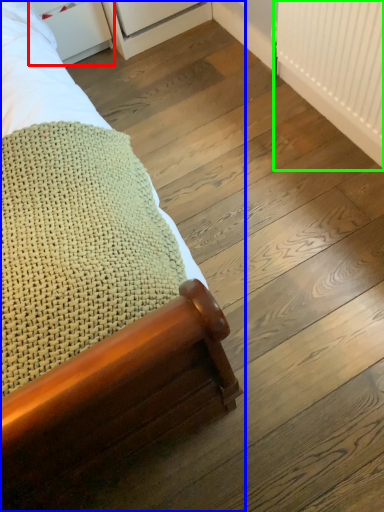
Question: Considering the real-world distances, which object is farthest from drawer (highlighted by a red box)? bed (highlighted by a blue box) or radiator (highlighted by a green box)?

Choices:
 (A) bed
 (B) radiator

Answer: (B)